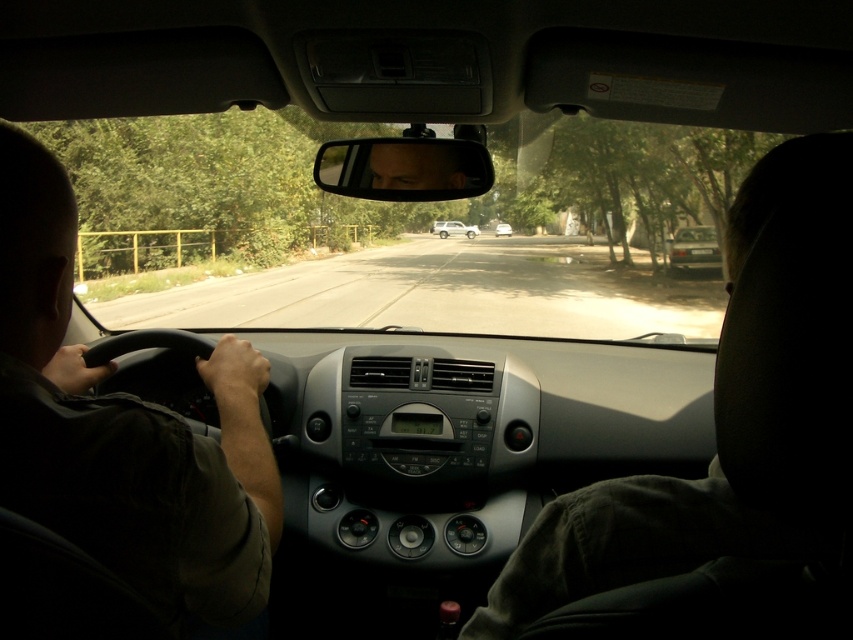
Question: Among these points, which one is farthest from the camera?

Choices:
 (A) (508, 227)
 (B) (467, 237)
 (C) (432, 172)

Answer: (B)

Question: Which point is closer to the camera?

Choices:
 (A) (440, 228)
 (B) (505, 228)
 (C) (241, 550)
 (D) (674, 236)

Answer: (C)

Question: Can you confirm if dark brown leather steering wheel at left is positioned above matte gray sedan at center?

Choices:
 (A) yes
 (B) no

Answer: (B)

Question: Among these points, which one is nearest to the camera?

Choices:
 (A) (93, 413)
 (B) (335, 192)

Answer: (A)

Question: Can you confirm if dark brown leather steering wheel at left is wider than silver metallic sedan at center?

Choices:
 (A) no
 (B) yes

Answer: (A)

Question: Does matte plastic view mirror at center appear over silver metallic sedan at center?

Choices:
 (A) no
 (B) yes

Answer: (A)